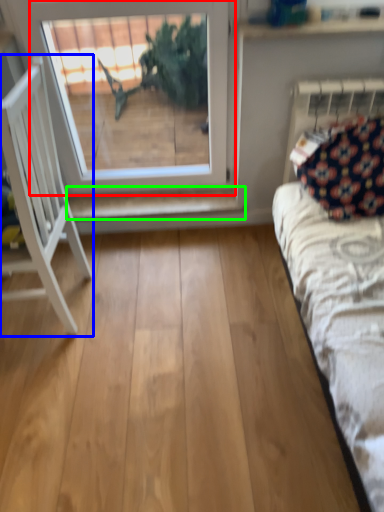
Question: Based on their relative distances, which object is nearer to window (highlighted by a red box)? Choose from furniture (highlighted by a blue box) and shelf (highlighted by a green box).

Choices:
 (A) furniture
 (B) shelf

Answer: (B)